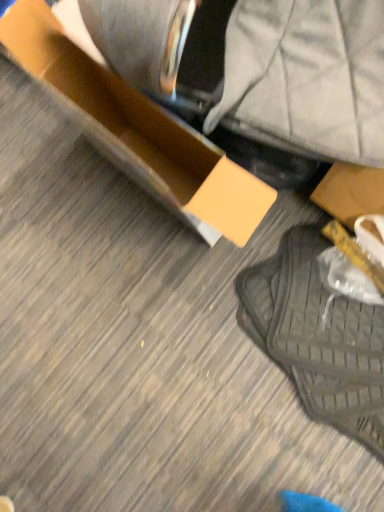
Question: In terms of height, does matte cardboard box at center look taller or shorter compared to black mesh bag at lower right?

Choices:
 (A) tall
 (B) short

Answer: (A)

Question: Which is correct: matte cardboard box at center is inside black mesh bag at lower right, or outside of it?

Choices:
 (A) inside
 (B) outside

Answer: (B)

Question: Is matte cardboard box at center bigger or smaller than black mesh bag at lower right?

Choices:
 (A) big
 (B) small

Answer: (A)

Question: In the image, is black mesh bag at lower right on the left side or the right side of matte cardboard box at center?

Choices:
 (A) right
 (B) left

Answer: (A)

Question: Choose the correct answer: Is black mesh bag at lower right inside matte cardboard box at center or outside it?

Choices:
 (A) inside
 (B) outside

Answer: (B)

Question: In terms of height, does black mesh bag at lower right look taller or shorter compared to matte cardboard box at center?

Choices:
 (A) short
 (B) tall

Answer: (A)

Question: Looking at the image, does black mesh bag at lower right seem bigger or smaller compared to matte cardboard box at center?

Choices:
 (A) small
 (B) big

Answer: (A)